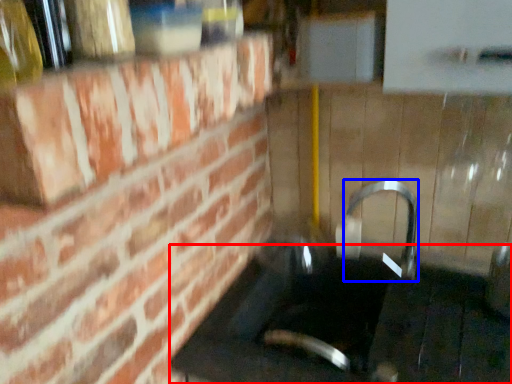
Question: Among these objects, which one is nearest to the camera, counter top (highlighted by a red box) or faucet (highlighted by a blue box)?

Choices:
 (A) counter top
 (B) faucet

Answer: (A)